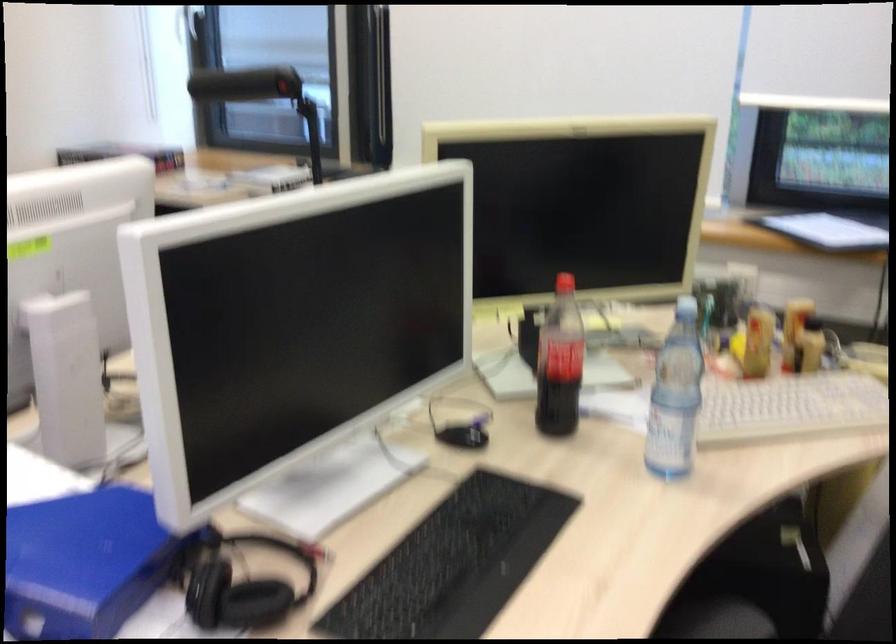
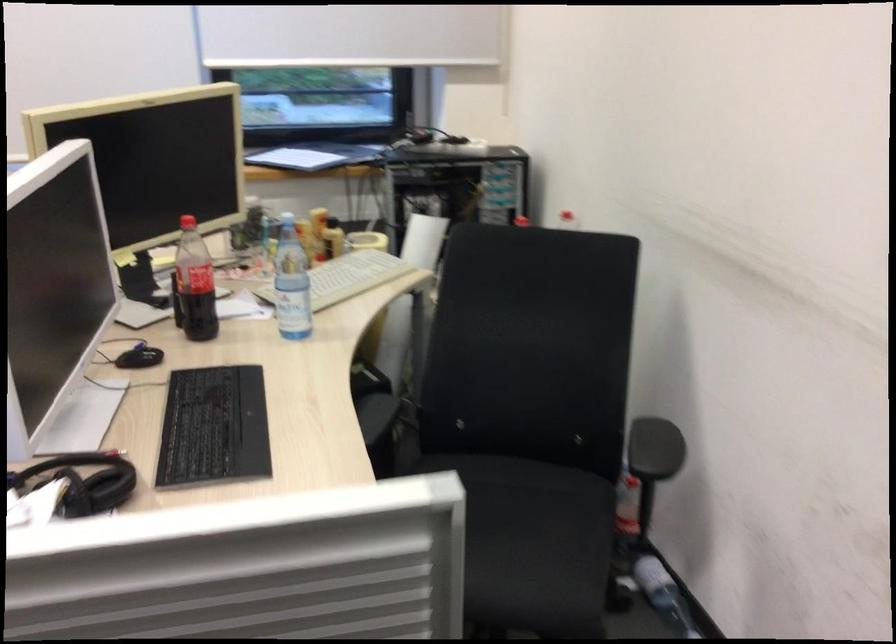
The point at [565,363] is marked in the first image. Where is the corresponding point in the second image?

(194, 283)